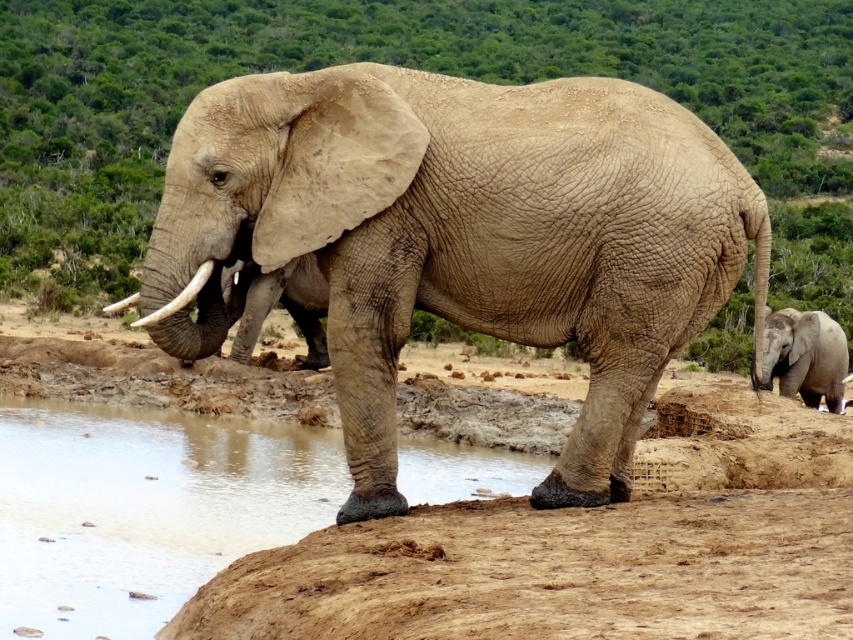
Is white ivory tusk at left in front of white matte tusk at left?

Yes, white ivory tusk at left is closer to the viewer.

Is white ivory tusk at left smaller than white matte tusk at left?

Indeed, white ivory tusk at left has a smaller size compared to white matte tusk at left.

At what (x,y) coordinates should I click in order to perform the action: click on white ivory tusk at left. Please return your answer as a coordinate pair (x, y). The width and height of the screenshot is (853, 640). Looking at the image, I should click on (178, 296).

Find the location of a particular element. white ivory tusk at left is located at coordinates (178, 296).

Between point (242, 520) and point (212, 268), which one is positioned behind?

The point (242, 520) is behind.

Is the position of brown sandy dirt at lower center less distant than that of white ivory tusk at left?

That is True.

Is point (294, 529) positioned after point (140, 317)?

Yes, it is behind point (140, 317).

Locate an element on the screen. brown sandy dirt at lower center is located at coordinates (415, 531).

Measure the distance from rough textured elephant at center to brown sandy dirt at lower center.

rough textured elephant at center and brown sandy dirt at lower center are 14.52 feet apart from each other.

Which is more to the right, rough textured elephant at center or brown sandy dirt at lower center?

From the viewer's perspective, brown sandy dirt at lower center appears more on the right side.

Where is `rough textured elephant at center`? This screenshot has height=640, width=853. rough textured elephant at center is located at coordinates (463, 237).